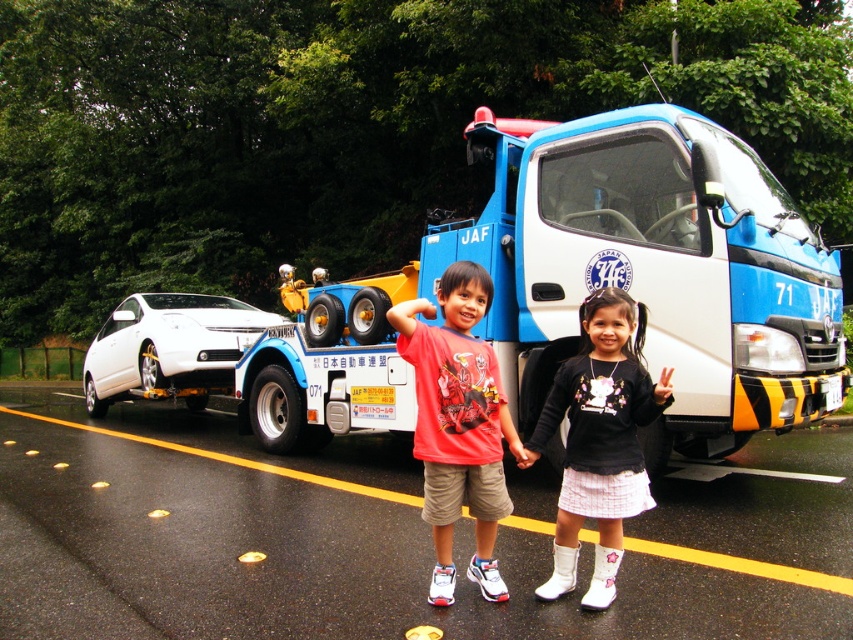
You are a pedestrian standing at the origin point of the image. You need to locate the matte red shirt at center. Which direction should you look relative to your position?

The matte red shirt at center is located at point (599, 440), so you should look towards the upper right direction from your position at the origin.

In the scene shown: You are a delivery person carrying a large package that requires you to walk around the black matte sweater at center and the white glossy car at left. Given that the distance between them is 7.73 meters, can you safely navigate through the space between them without hitting either object?

The distance between the black matte sweater at center and the white glossy car at left is 7.73 meters. Since the space between them is over 7 meters, it is safe for you to navigate through the space between them without hitting either object.